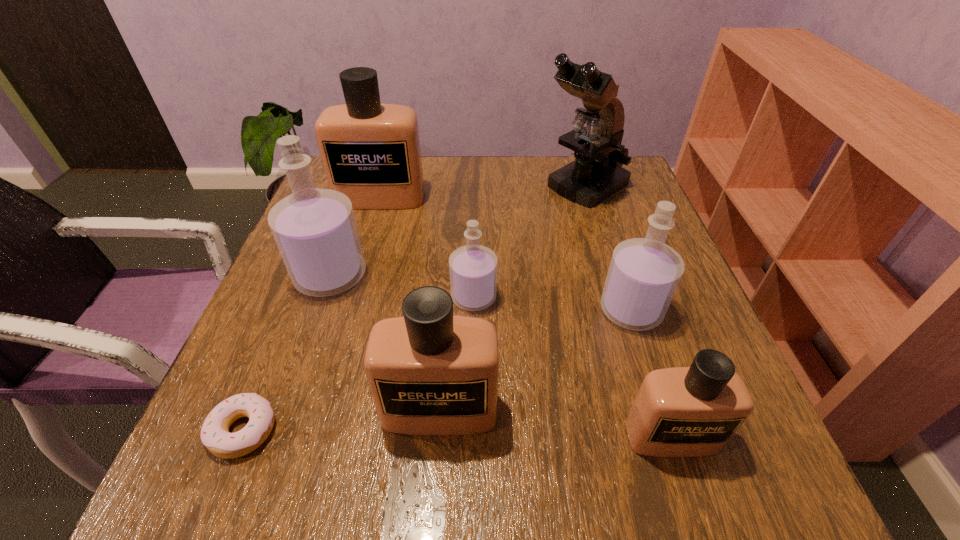
Locate which object is the seventh closest to the microscope. Please provide its 2D coordinates. Your answer should be formatted as a tuple, i.e. [(x, y)], where the tuple contains the x and y coordinates of a point satisfying the conditions above.

[(215, 435)]

Select which perfume is the closest to the second biggest purple perfume. Please provide its 2D coordinates. Your answer should be formatted as a tuple, i.e. [(x, y)], where the tuple contains the x and y coordinates of a point satisfying the conditions above.

[(694, 411)]

Point out which perfume is positioned as the third nearest to the farthest beige perfume. Please provide its 2D coordinates. Your answer should be formatted as a tuple, i.e. [(x, y)], where the tuple contains the x and y coordinates of a point satisfying the conditions above.

[(644, 273)]

Locate which beige perfume ranks in proximity to the smallest purple perfume. Please provide its 2D coordinates. Your answer should be formatted as a tuple, i.e. [(x, y)], where the tuple contains the x and y coordinates of a point satisfying the conditions above.

[(430, 373)]

You are a GUI agent. You are given a task and a screenshot of the screen. Output one action in this format:
    pyautogui.click(x=<x>, y=<y>)
    Task: Click on the beige perfume that is the third closest one to the smallest purple perfume
    Image resolution: width=960 pixels, height=540 pixels.
    Given the screenshot: What is the action you would take?
    pyautogui.click(x=694, y=411)

Identify which purple perfume is located as the nearest to the farthest perfume. Please provide its 2D coordinates. Your answer should be formatted as a tuple, i.e. [(x, y)], where the tuple contains the x and y coordinates of a point satisfying the conditions above.

[(315, 230)]

Identify which purple perfume is the third closest to the shortest object. Please provide its 2D coordinates. Your answer should be formatted as a tuple, i.e. [(x, y)], where the tuple contains the x and y coordinates of a point satisfying the conditions above.

[(644, 273)]

Identify the location of free space in the image that satisfies the following two spatial constraints: 1. on the front label of the farthest perfume; 2. on the left side of the smallest purple perfume. This screenshot has width=960, height=540. (351, 297).